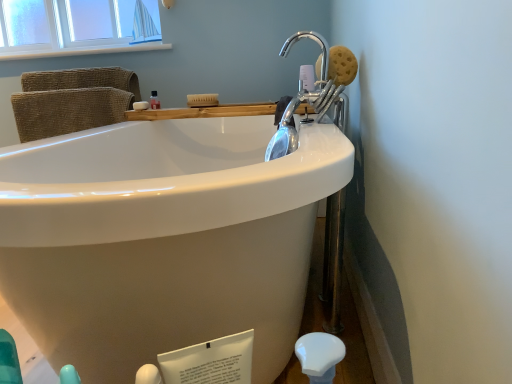
In the scene shown: Measure the distance between point (x=349, y=53) and camera.

The depth of point (x=349, y=53) is 1.27 meters.

Where is `translucent plastic bottle at upper center`? The width and height of the screenshot is (512, 384). translucent plastic bottle at upper center is located at coordinates (154, 100).

The image size is (512, 384). Describe the element at coordinates (154, 100) in the screenshot. I see `translucent plastic bottle at upper center` at that location.

What do you see at coordinates (202, 112) in the screenshot? The image size is (512, 384). I see `wooden tray at upper center` at bounding box center [202, 112].

This screenshot has height=384, width=512. Identify the location of brown sponge at upper right, the second soap positioned from the left. click(x=342, y=65).

Does white wood window sill at upper left come behind translucent plastic bottle at upper center?

That is True.

From the image's perspective, is white wood window sill at upper left located beneath translucent plastic bottle at upper center?

No.

Would you say white wood window sill at upper left is a long distance from translucent plastic bottle at upper center?

They are positioned close to each other.

Who is smaller, white wood window sill at upper left or translucent plastic bottle at upper center?

Smaller between the two is translucent plastic bottle at upper center.

Looking at this image, does wooden tray at upper center have a greater width compared to white wood window sill at upper left?

Correct, the width of wooden tray at upper center exceeds that of white wood window sill at upper left.

Does wooden tray at upper center appear on the left side of white wood window sill at upper left?

In fact, wooden tray at upper center is to the right of white wood window sill at upper left.

From a real-world perspective, is wooden tray at upper center located higher than white wood window sill at upper left?

No, from a real-world perspective, wooden tray at upper center is not on top of white wood window sill at upper left.

Is wooden tray at upper center directly adjacent to white wood window sill at upper left?

No, wooden tray at upper center is not touching white wood window sill at upper left.

Looking at this image, considering the sizes of translucent plastic bottle at upper center and brown sponge at upper right, positioned as the second soap in back-to-front order, in the image, is translucent plastic bottle at upper center bigger or smaller than brown sponge at upper right, positioned as the second soap in back-to-front order,?

Clearly, translucent plastic bottle at upper center is smaller in size than brown sponge at upper right, positioned as the second soap in back-to-front order.

Considering the relative positions of translucent plastic bottle at upper center and brown sponge at upper right, the second soap positioned from the left, in the image provided, is translucent plastic bottle at upper center to the left of brown sponge at upper right, the second soap positioned from the left, from the viewer's perspective?

Yes, translucent plastic bottle at upper center is to the left of brown sponge at upper right, the second soap positioned from the left.

From a real-world perspective, is translucent plastic bottle at upper center beneath brown sponge at upper right, positioned as the second soap in back-to-front order?

Yes, from a real-world perspective, translucent plastic bottle at upper center is below brown sponge at upper right, positioned as the second soap in back-to-front order.

Is translucent plastic bottle at upper center thinner than brown sponge at upper right, the second soap positioned from the left?

Yes.

Consider the image. Would you say white matte soap at upper left, marked as the 1th soap in a back-to-front arrangement, is part of wooden tray at upper center's contents?

No, wooden tray at upper center does not contain white matte soap at upper left, marked as the 1th soap in a back-to-front arrangement.

Which is more to the left, wooden tray at upper center or white matte soap at upper left, positioned as the second soap in front-to-back order?

white matte soap at upper left, positioned as the second soap in front-to-back order, is more to the left.

Based on the photo, is wooden tray at upper center not close to white matte soap at upper left, positioned as the second soap in front-to-back order?

No, wooden tray at upper center is in close proximity to white matte soap at upper left, positioned as the second soap in front-to-back order.

Where is `counter top on the right of white matte soap at upper left, which is counted as the second soap, starting from the right`? This screenshot has width=512, height=384. counter top on the right of white matte soap at upper left, which is counted as the second soap, starting from the right is located at coordinates (202, 112).

Does point (142, 103) come farther from viewer compared to point (88, 48)?

No, it is not.

From a real-world perspective, is white matte soap at upper left, the 1th soap in the left-to-right sequence, beneath white wood window sill at upper left?

Indeed, from a real-world perspective, white matte soap at upper left, the 1th soap in the left-to-right sequence, is positioned beneath white wood window sill at upper left.

Locate an element on the screen. window sill located on the left of white matte soap at upper left, which is counted as the second soap, starting from the right is located at coordinates (84, 51).

From the image's perspective, is white matte soap at upper left, which is counted as the second soap, starting from the right, on white wood window sill at upper left?

Actually, white matte soap at upper left, which is counted as the second soap, starting from the right, appears below white wood window sill at upper left in the image.

Is brown sponge at upper right, positioned as the 1th soap in front-to-back order, not close to wooden tray at upper center?

They are positioned close to each other.

From the image's perspective, which one is positioned lower, brown sponge at upper right, the 1th soap viewed from the right, or wooden tray at upper center?

wooden tray at upper center.

Find the location of a particular element. The image size is (512, 384). counter top below the brown sponge at upper right, the second soap positioned from the left (from a real-world perspective) is located at coordinates (202, 112).

Is translucent plastic bottle at upper center facing towards white wood window sill at upper left?

No, translucent plastic bottle at upper center is not facing towards white wood window sill at upper left.

Who is more distant, translucent plastic bottle at upper center or white wood window sill at upper left?

white wood window sill at upper left.

From a real-world perspective, which is physically above, translucent plastic bottle at upper center or white wood window sill at upper left?

white wood window sill at upper left.

Image resolution: width=512 pixels, height=384 pixels. Find the location of `mouthwash below the white wood window sill at upper left (from the image's perspective)`. mouthwash below the white wood window sill at upper left (from the image's perspective) is located at coordinates (154, 100).

Locate an element on the screen. window sill located above the translucent plastic bottle at upper center (from the image's perspective) is located at coordinates (84, 51).

Where is `counter top on the right of white wood window sill at upper left`? counter top on the right of white wood window sill at upper left is located at coordinates (202, 112).

Estimate the real-world distances between objects in this image. Which object is further from brown sponge at upper right, positioned as the second soap in back-to-front order, white wood window sill at upper left or white matte soap at upper left, positioned as the second soap in front-to-back order?

Among the two, white wood window sill at upper left is located further to brown sponge at upper right, positioned as the second soap in back-to-front order.

Which object lies nearer to the anchor point white wood window sill at upper left, white matte soap at upper left, the 1th soap in the left-to-right sequence, or wooden tray at upper center?

white matte soap at upper left, the 1th soap in the left-to-right sequence, lies closer to white wood window sill at upper left than the other object.

From the image, which object appears to be nearer to brown sponge at upper right, positioned as the 1th soap in front-to-back order, wooden tray at upper center or translucent plastic bottle at upper center?

The object closer to brown sponge at upper right, positioned as the 1th soap in front-to-back order, is wooden tray at upper center.

In the scene shown: Looking at the image, which one is located further to translucent plastic bottle at upper center, white matte soap at upper left, positioned as the second soap in front-to-back order, or white wood window sill at upper left?

white wood window sill at upper left is positioned further to the anchor translucent plastic bottle at upper center.

Considering their positions, is brown sponge at upper right, positioned as the 1th soap in front-to-back order, positioned further to white matte soap at upper left, which is counted as the second soap, starting from the right, than white wood window sill at upper left?

white wood window sill at upper left lies further to white matte soap at upper left, which is counted as the second soap, starting from the right, than the other object.

In the scene shown: From the image, which object appears to be nearer to brown sponge at upper right, the second soap positioned from the left, white wood window sill at upper left or wooden tray at upper center?

wooden tray at upper center.

Estimate the real-world distances between objects in this image. Which object is further from brown sponge at upper right, positioned as the 1th soap in front-to-back order, white wood window sill at upper left or translucent plastic bottle at upper center?

white wood window sill at upper left is positioned further to the anchor brown sponge at upper right, positioned as the 1th soap in front-to-back order.

When comparing their distances from white wood window sill at upper left, does brown sponge at upper right, positioned as the 1th soap in front-to-back order, or white matte soap at upper left, positioned as the second soap in front-to-back order, seem further?

The object further to white wood window sill at upper left is brown sponge at upper right, positioned as the 1th soap in front-to-back order.

This screenshot has width=512, height=384. Identify the location of counter top between white wood window sill at upper left and brown sponge at upper right, positioned as the 1th soap in front-to-back order, from left to right. (202, 112).

This screenshot has height=384, width=512. I want to click on mouthwash between white matte soap at upper left, marked as the 1th soap in a back-to-front arrangement, and brown sponge at upper right, the second soap positioned from the left, so click(154, 100).

The image size is (512, 384). What are the coordinates of `mouthwash between white wood window sill at upper left and wooden tray at upper center` in the screenshot? It's located at (154, 100).

Find the location of `counter top between white matte soap at upper left, positioned as the second soap in front-to-back order, and brown sponge at upper right, the 1th soap viewed from the right, from left to right`. counter top between white matte soap at upper left, positioned as the second soap in front-to-back order, and brown sponge at upper right, the 1th soap viewed from the right, from left to right is located at coordinates (202, 112).